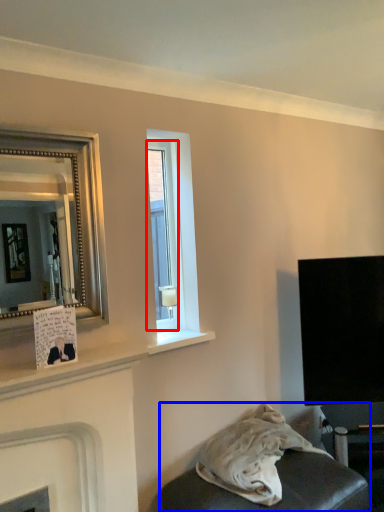
Question: Which object is further to the camera taking this photo, window (highlighted by a red box) or furniture (highlighted by a blue box)?

Choices:
 (A) window
 (B) furniture

Answer: (A)